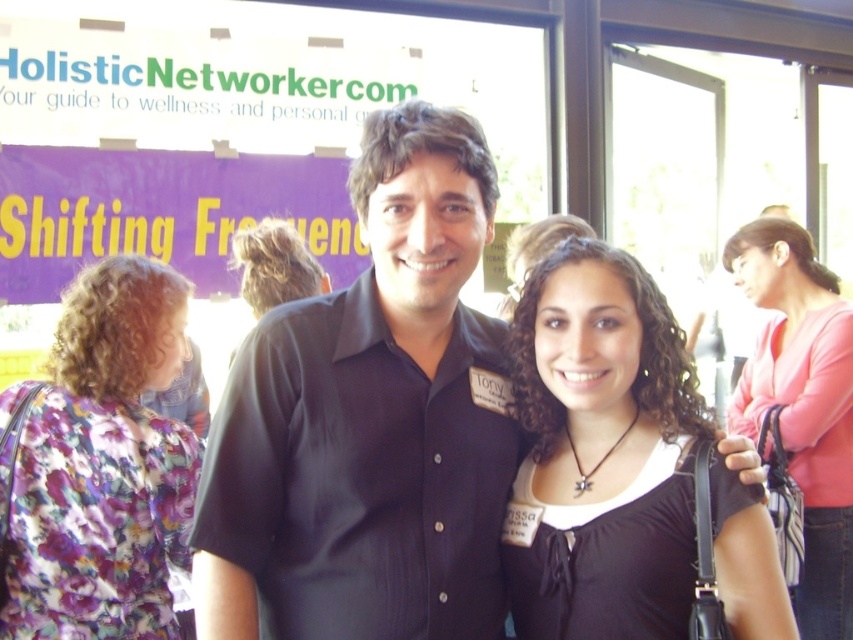
You are at a public event and see two people wearing black shirts. The first person is wearing a black smooth shirt at center, and the second is wearing a black matte shirt at center. Which shirt is more visible to you?

The black smooth shirt at center is more visible to you because it is in front of the black matte shirt at center.

You are at a social gathering and want to take a photo with the black matte shirt at center and the pink fabric shirt at upper right in the background. Which shirt should be placed higher in the frame to ensure both are visible?

The black matte shirt at center should be placed higher in the frame because it is already located above the pink fabric shirt at upper right, so positioning it higher will maintain their natural arrangement and ensure both are visible.